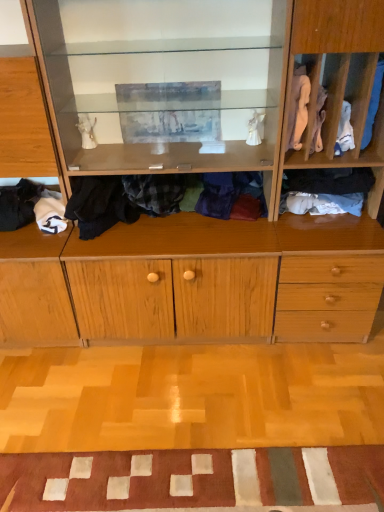
Where is `free location above dark blue fabric at right, which appears as the third clothing when viewed from the right (from a real-world perspective)`? free location above dark blue fabric at right, which appears as the third clothing when viewed from the right (from a real-world perspective) is located at coordinates (335, 164).